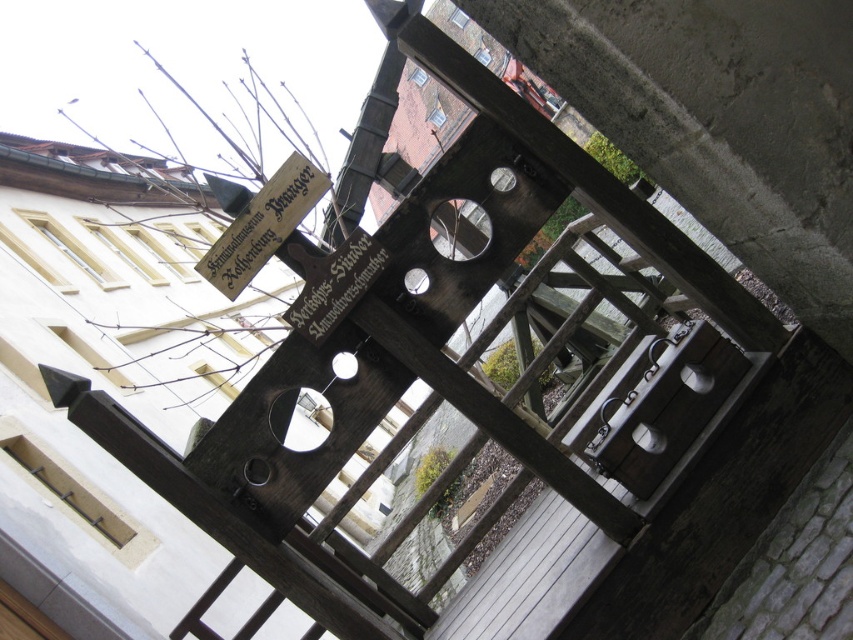
Is the position of wooden sign at upper left less distant than that of wooden sign at center?

Yes, it is.

Can you confirm if wooden sign at upper left is positioned below wooden sign at center?

No, wooden sign at upper left is not below wooden sign at center.

Where is `wooden sign at upper left`? wooden sign at upper left is located at coordinates (263, 225).